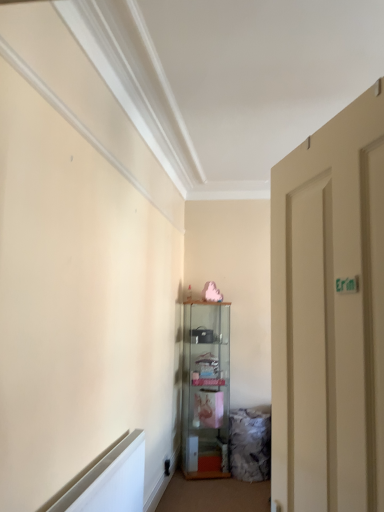
The height and width of the screenshot is (512, 384). I want to click on clear glass cabinet at center, so click(206, 389).

Describe the element at coordinates (206, 389) in the screenshot. This screenshot has height=512, width=384. I see `clear glass cabinet at center` at that location.

The height and width of the screenshot is (512, 384). What are the coordinates of `beige matte door at right` in the screenshot? It's located at (329, 315).

This screenshot has height=512, width=384. What do you see at coordinates (329, 315) in the screenshot?
I see `beige matte door at right` at bounding box center [329, 315].

What are the coordinates of `clear glass cabinet at center` in the screenshot? It's located at (206, 389).

Is clear glass cabinet at center to the right of beige matte door at right from the viewer's perspective?

No, clear glass cabinet at center is not to the right of beige matte door at right.

Is clear glass cabinet at center in front of or behind beige matte door at right in the image?

In the image, clear glass cabinet at center appears behind beige matte door at right.

Which is in front, point (187, 346) or point (296, 261)?

The point (296, 261) is in front.

Based on the photo, from the image's perspective, is clear glass cabinet at center below beige matte door at right?

Indeed, from the image's perspective, clear glass cabinet at center is shown beneath beige matte door at right.

From a real-world perspective, which object stands above the other?

From a 3D spatial view, beige matte door at right is above.

Which of these two, clear glass cabinet at center or beige matte door at right, is wider?

Wider between the two is clear glass cabinet at center.

Does clear glass cabinet at center have a greater height compared to beige matte door at right?

Yes.

Between clear glass cabinet at center and beige matte door at right, which one has larger size?

clear glass cabinet at center.

Choose the correct answer: Is clear glass cabinet at center inside beige matte door at right or outside it?

The correct answer is: outside.

Are clear glass cabinet at center and beige matte door at right located far from each other?

Yes, clear glass cabinet at center is far from beige matte door at right.

Is clear glass cabinet at center oriented towards beige matte door at right?

Yes, clear glass cabinet at center is facing beige matte door at right.

What's the angular difference between clear glass cabinet at center and beige matte door at right's facing directions?

The angle between the facing direction of clear glass cabinet at center and the facing direction of beige matte door at right is 84.5 degrees.

At what (x,y) coordinates should I click in order to perform the action: click on door in front of the clear glass cabinet at center. Please return your answer as a coordinate pair (x, y). The width and height of the screenshot is (384, 512). Looking at the image, I should click on (329, 315).

Considering the relative positions of beige matte door at right and clear glass cabinet at center in the image provided, is beige matte door at right to the left or to the right of clear glass cabinet at center?

In the image, beige matte door at right appears on the right side of clear glass cabinet at center.

Considering the positions of objects beige matte door at right and clear glass cabinet at center in the image provided, who is in front, beige matte door at right or clear glass cabinet at center?

Positioned in front is beige matte door at right.

Is point (373, 509) less distant than point (184, 353)?

Yes.

From the image's perspective, would you say beige matte door at right is shown under clear glass cabinet at center?

Actually, beige matte door at right appears above clear glass cabinet at center in the image.

From a real-world perspective, which is physically below, beige matte door at right or clear glass cabinet at center?

clear glass cabinet at center.

Between beige matte door at right and clear glass cabinet at center, which one has larger width?

With larger width is clear glass cabinet at center.

Who is shorter, beige matte door at right or clear glass cabinet at center?

With less height is beige matte door at right.

Does beige matte door at right have a smaller size compared to clear glass cabinet at center?

Correct, beige matte door at right occupies less space than clear glass cabinet at center.

Is beige matte door at right positioned beyond the bounds of clear glass cabinet at center?

Yes, beige matte door at right is outside of clear glass cabinet at center.

Is beige matte door at right far from clear glass cabinet at center?

That's right, there is a large distance between beige matte door at right and clear glass cabinet at center.

Could you tell me if beige matte door at right is facing clear glass cabinet at center?

No, beige matte door at right does not turn towards clear glass cabinet at center.

Can you tell me how much beige matte door at right and clear glass cabinet at center differ in facing direction?

The angle between the facing direction of beige matte door at right and the facing direction of clear glass cabinet at center is 84.5 degrees.

How much distance is there between beige matte door at right and clear glass cabinet at center?

beige matte door at right is 3.21 meters away from clear glass cabinet at center.

This screenshot has height=512, width=384. What are the coordinates of `cabinetry behind the beige matte door at right` in the screenshot? It's located at (206, 389).

The image size is (384, 512). What are the coordinates of `cabinetry located underneath the beige matte door at right (from a real-world perspective)` in the screenshot? It's located at (206, 389).

You are a GUI agent. You are given a task and a screenshot of the screen. Output one action in this format:
    pyautogui.click(x=<x>, y=<y>)
    Task: Click on the cabinetry that is behind the beige matte door at right
    Image resolution: width=384 pixels, height=512 pixels.
    Given the screenshot: What is the action you would take?
    pyautogui.click(x=206, y=389)